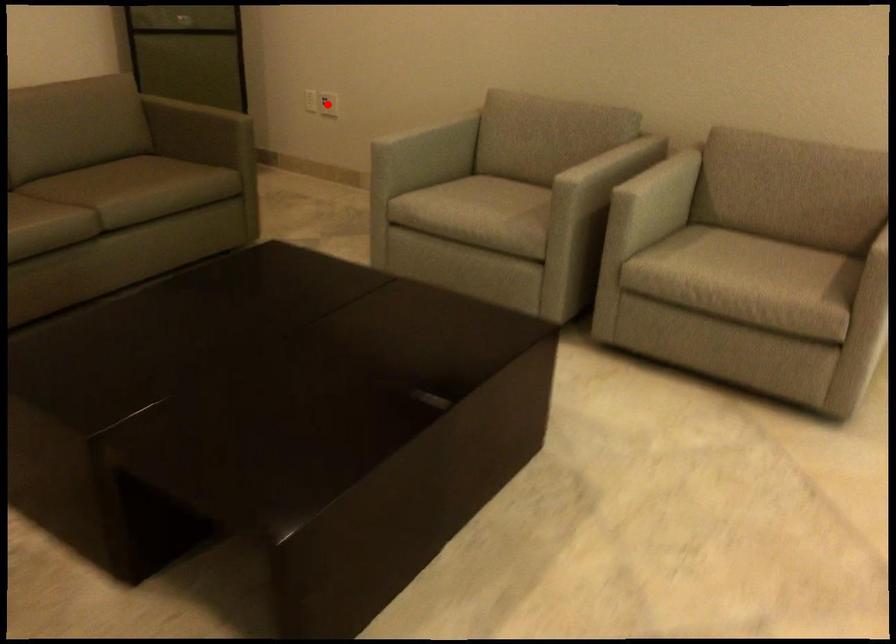
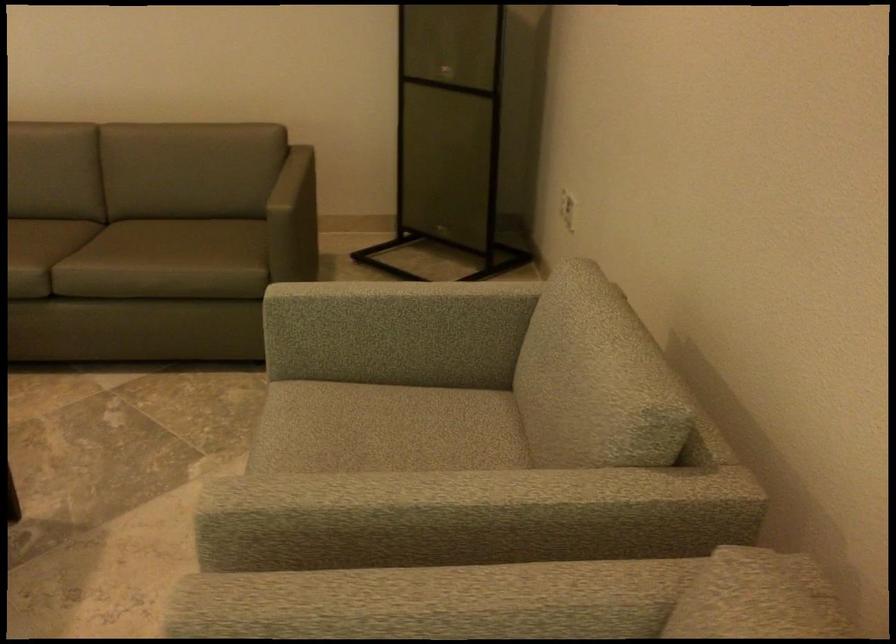
Question: I am providing you with two images of the same scene from different viewpoints. A red point is marked on the first image. Is the red point's position out of view in image 2?

Choices:
 (A) Yes
 (B) No

Answer: (A)